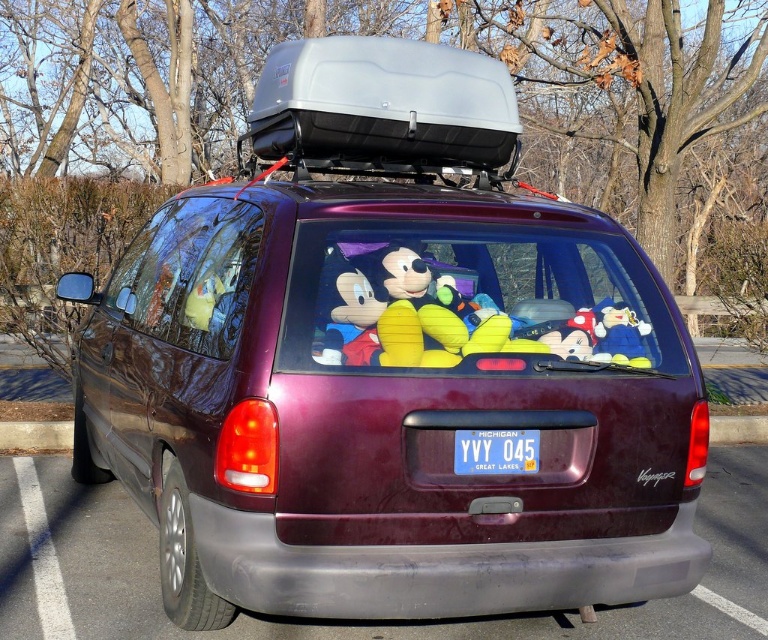
Looking at this image, you are a delivery driver who needs to park your van in a specific spot. You see the maroon metallic van at center and the blue plastic license plate at center in the parking lot. Which object is positioned more to the left side?

The maroon metallic van at center is positioned more to the left than the blue plastic license plate at center.

You are a delivery person trying to load a package onto the roof of the maroon metallic van at center. The package is 1 meter tall. Can you safely place it on top of the gray plastic cargo box at center without exceeding the height limit set by the transportation authority?

The maroon metallic van at center is positioned under the gray plastic cargo box at center, meaning the cargo box is already on top of the van. Since the package is 1 meter tall, adding it on top of the cargo box may exceed the height limit, so it is not safe to place it there.

You are a delivery person who needs to load a package into the gray plastic cargo box at center. However, you notice the blue plastic license plate at center is in the way. Based on the scene, can you determine if the license plate will interfere with placing the package into the cargo box?

The gray plastic cargo box at center is much taller than the blue plastic license plate at center, so the license plate is lower and less likely to interfere with placing the package into the cargo box.